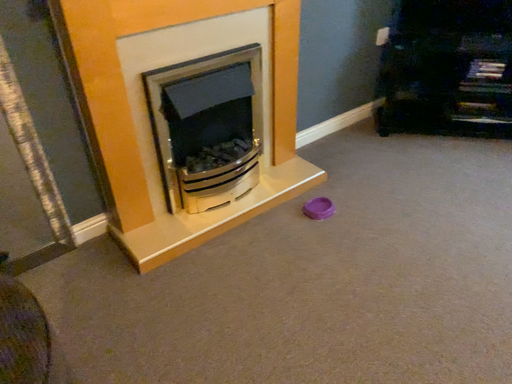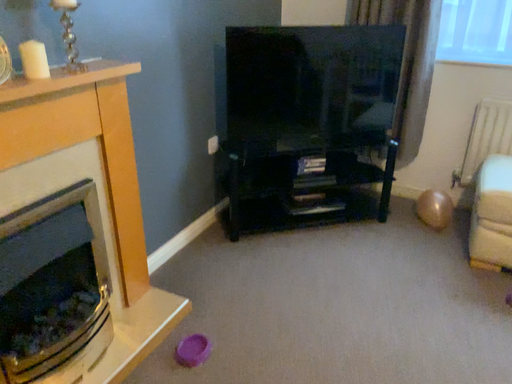
Question: Which way did the camera rotate in the video?

Choices:
 (A) rotated left
 (B) rotated right

Answer: (B)